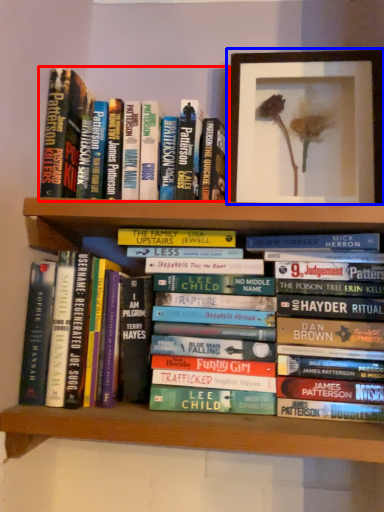
Question: Which point is closer to the camera, book (highlighted by a red box) or picture frame (highlighted by a blue box)?

Choices:
 (A) book
 (B) picture frame

Answer: (A)